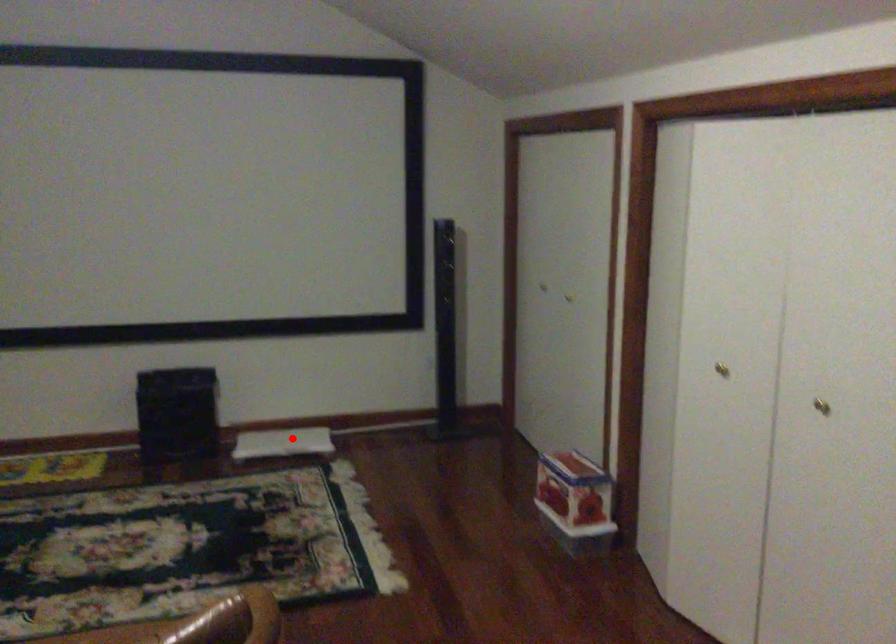
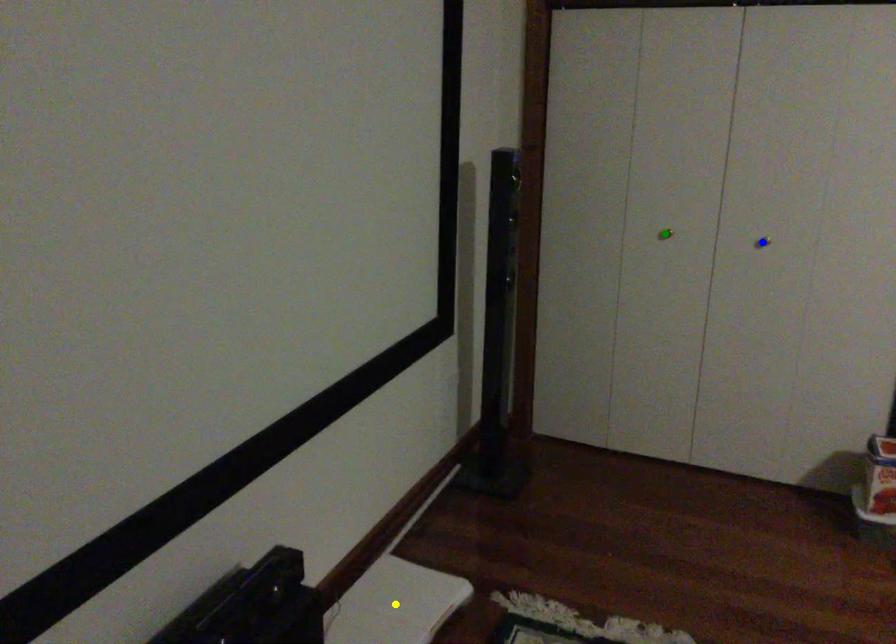
Question: I am providing you with two images of the same scene from different viewpoints. A red point is marked on the first image. You are given multiple points on the second image. Which spot in image 2 lines up with the point in image 1?

Choices:
 (A) yellow point
 (B) blue point
 (C) green point

Answer: (A)